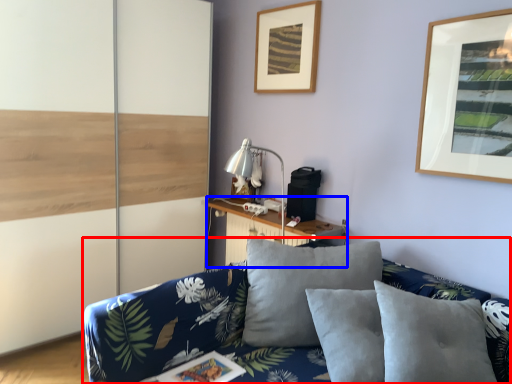
Question: Which object appears closest to the camera in this image, studio couch (highlighted by a red box) or table (highlighted by a blue box)?

Choices:
 (A) studio couch
 (B) table

Answer: (A)